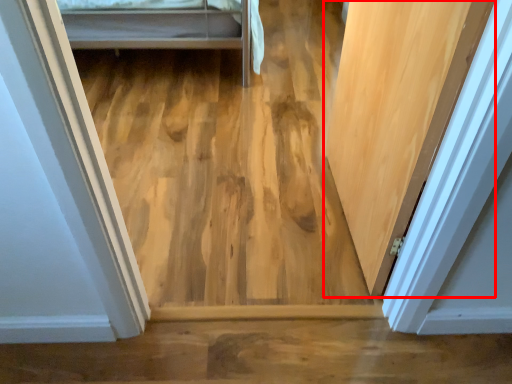
Question: From the image's perspective, what is the correct spatial positioning of door (annotated by the red box) in reference to plywood?

Choices:
 (A) above
 (B) below

Answer: (B)